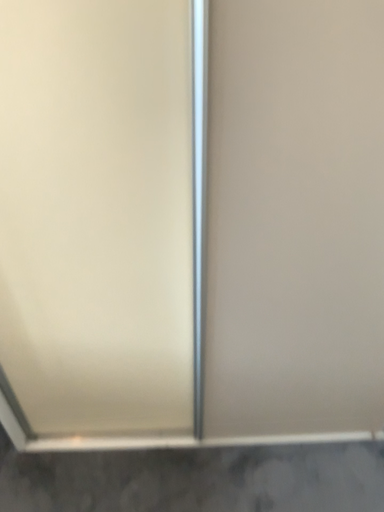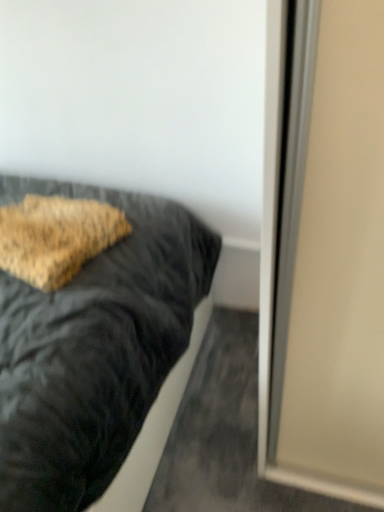
Question: How did the camera likely rotate when shooting the video?

Choices:
 (A) rotated right
 (B) rotated left

Answer: (B)